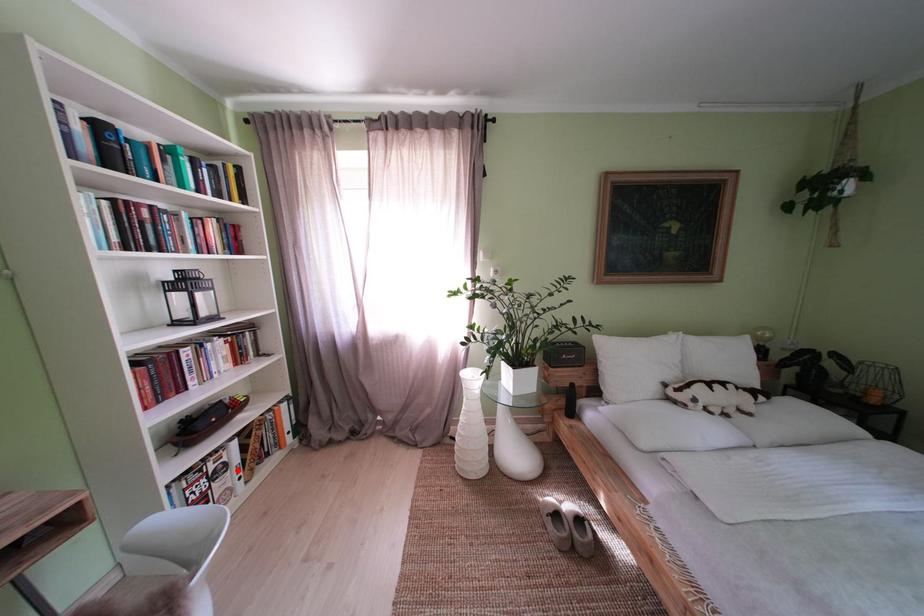
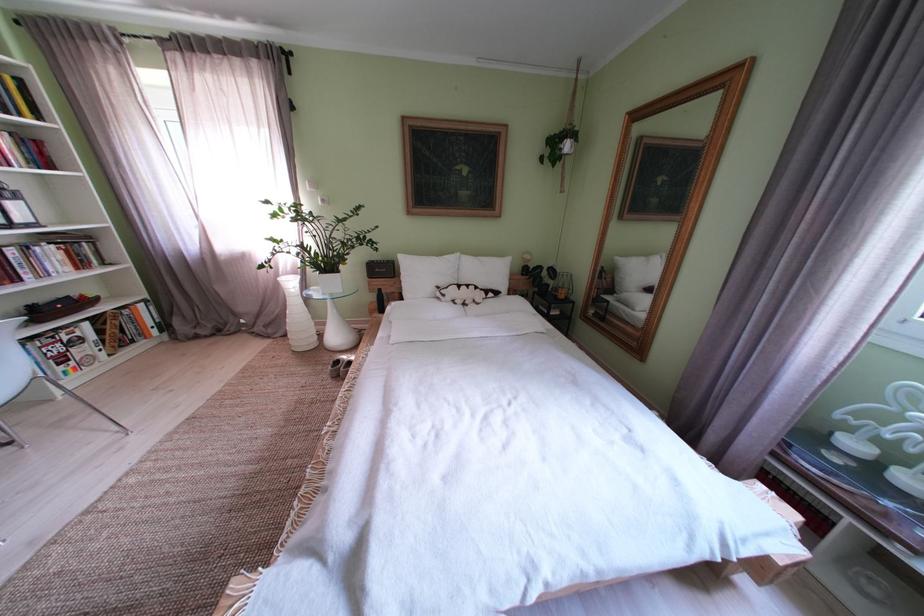
Question: I am providing you with two images of the same scene from different viewpoints. A red point is shown in image1. For the corresponding object point in image2, is it positioned nearer or farther from the camera?

Choices:
 (A) Nearer
 (B) Farther

Answer: (B)